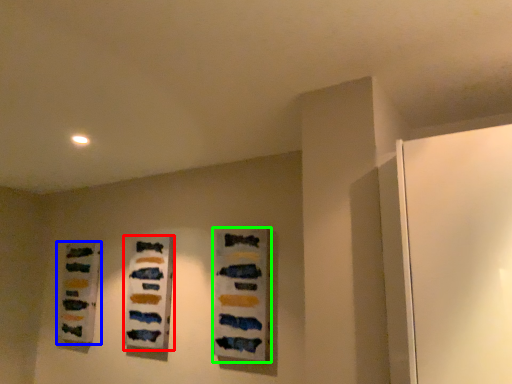
Question: Which object is the farthest from art (highlighted by a red box)? Choose among these: art (highlighted by a blue box) or art (highlighted by a green box).

Choices:
 (A) art
 (B) art

Answer: (A)